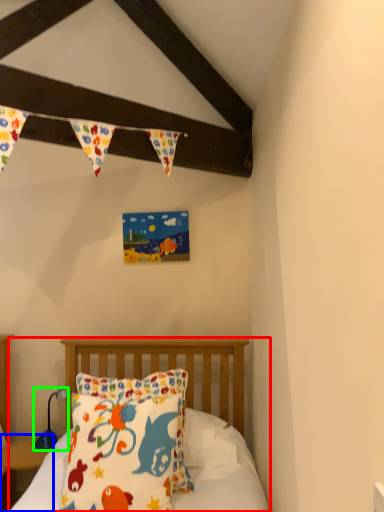
Question: Which is nearer to the bed (highlighted by a red box)? nightstand (highlighted by a blue box) or lamp (highlighted by a green box).

Choices:
 (A) nightstand
 (B) lamp

Answer: (B)